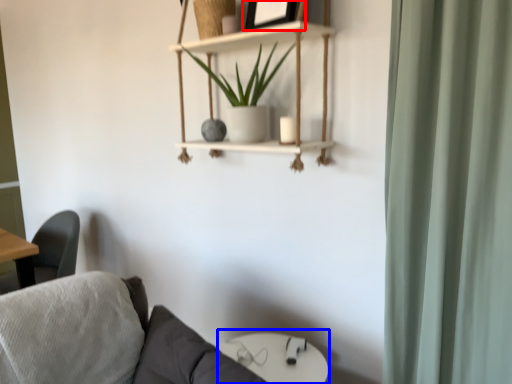
Question: Among these objects, which one is farthest to the camera, picture frame (highlighted by a red box) or round table (highlighted by a blue box)?

Choices:
 (A) picture frame
 (B) round table

Answer: (B)